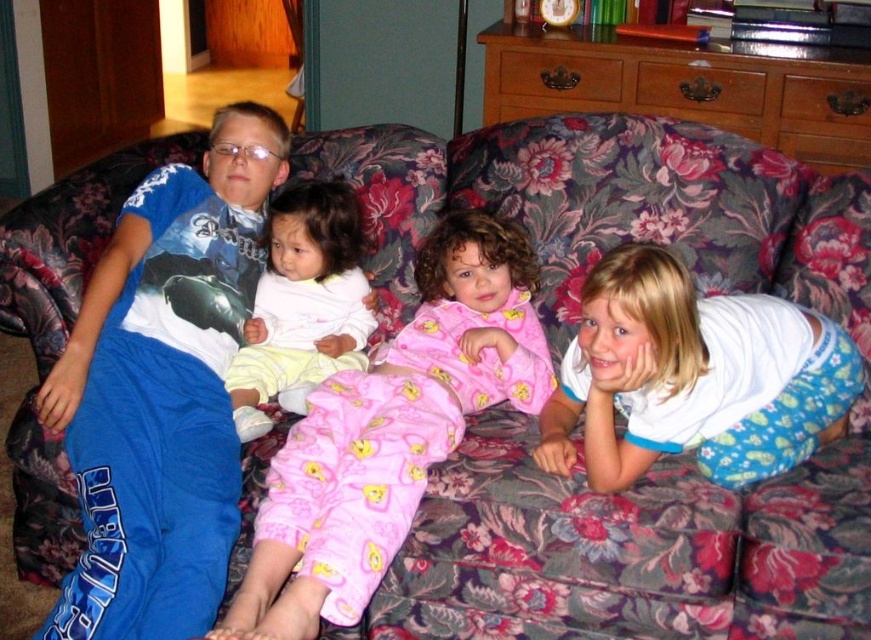
You are a photographer setting up for a family photo. You need to ensure that both the pink cotton pajamas at center and the white soft baby at center are fully visible in the frame. Given their sizes, which object should you prioritize positioning closer to the camera to avoid being cut off?

The white soft baby at center is smaller in width compared to the pink cotton pajamas at center. To ensure both are fully visible, prioritize positioning the white soft baby at center closer to the camera since its smaller size might be more likely to be cut off if placed further back.